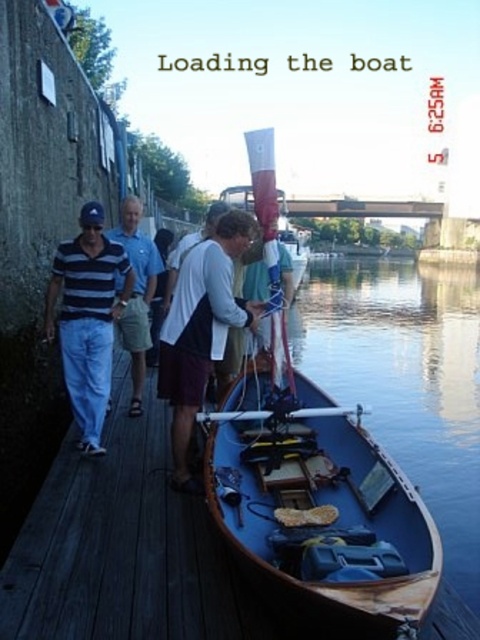
Does striped cotton shirt at left appear on the right side of striped cotton polo shirt at left?

No, striped cotton shirt at left is not to the right of striped cotton polo shirt at left.

Is striped cotton shirt at left bigger than striped cotton polo shirt at left?

Correct, striped cotton shirt at left is larger in size than striped cotton polo shirt at left.

Who is more distant from viewer, (78, 276) or (135, 332)?

The point (135, 332) is more distant.

Where is `striped cotton shirt at left`? striped cotton shirt at left is located at coordinates (87, 317).

Is point (288, 593) more distant than point (129, 314)?

No, it is not.

Who is shorter, dark blue wooden boat at center or striped cotton polo shirt at left?

With less height is dark blue wooden boat at center.

Identify the location of dark blue wooden boat at center. This screenshot has width=480, height=640. (319, 509).

Identify the location of dark blue wooden boat at center. click(x=319, y=509).

Can you confirm if dark blue wooden boat at center is smaller than white cotton shirt at center?

Incorrect, dark blue wooden boat at center is not smaller in size than white cotton shirt at center.

What do you see at coordinates (319, 509) in the screenshot? The height and width of the screenshot is (640, 480). I see `dark blue wooden boat at center` at bounding box center [319, 509].

What are the coordinates of `dark blue wooden boat at center` in the screenshot? It's located at (319, 509).